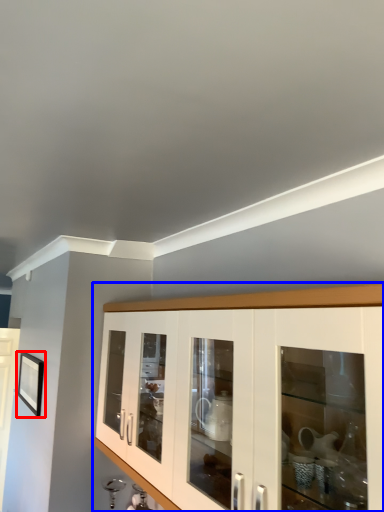
Question: Which point is further to the camera, picture frame (highlighted by a red box) or cabinetry (highlighted by a blue box)?

Choices:
 (A) picture frame
 (B) cabinetry

Answer: (A)